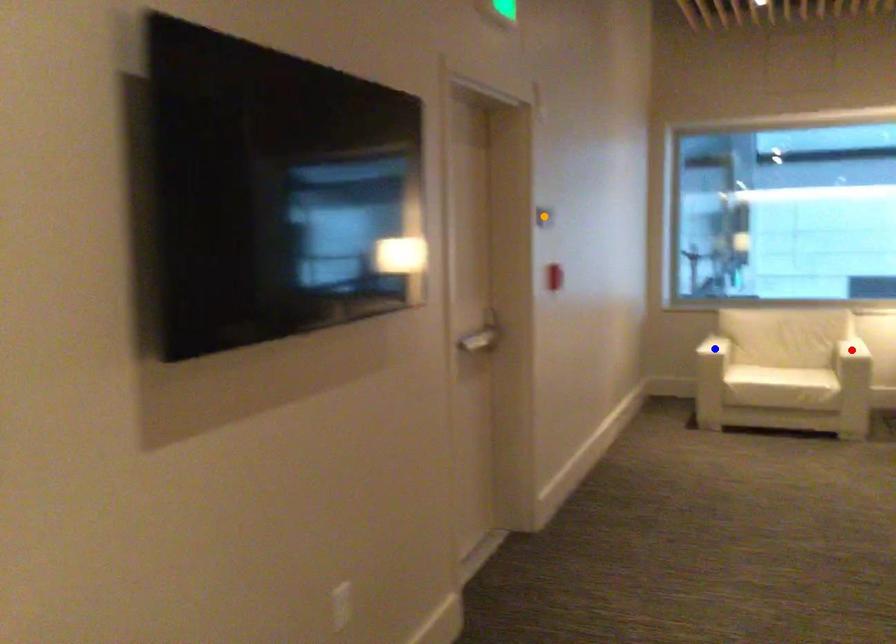
Order these from farthest to nearest:
red point
orange point
blue point

blue point
red point
orange point